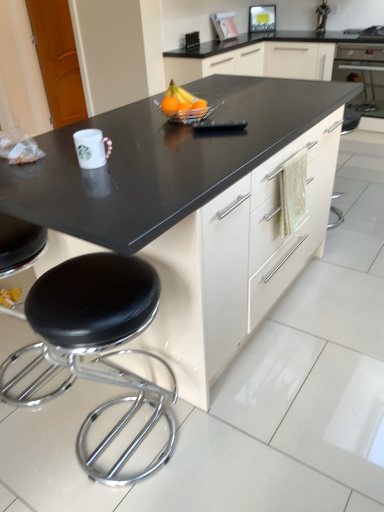
Question: Considering the relative positions of orange matte at center, positioned as the 2th orange in right-to-left order, and black glossy oven at upper right in the image provided, is orange matte at center, positioned as the 2th orange in right-to-left order, to the left of black glossy oven at upper right from the viewer's perspective?

Choices:
 (A) yes
 (B) no

Answer: (A)

Question: Considering the relative sizes of orange matte at center, positioned as the 2th orange in right-to-left order, and black glossy oven at upper right in the image provided, is orange matte at center, positioned as the 2th orange in right-to-left order, taller than black glossy oven at upper right?

Choices:
 (A) yes
 (B) no

Answer: (B)

Question: Is the depth of orange matte at center, positioned as the first orange in left-to-right order, less than that of black glossy oven at upper right?

Choices:
 (A) yes
 (B) no

Answer: (A)

Question: Is orange matte at center, positioned as the 2th orange in right-to-left order, oriented towards black glossy oven at upper right?

Choices:
 (A) no
 (B) yes

Answer: (A)

Question: Is black glossy oven at upper right inside orange matte at center, positioned as the 2th orange in right-to-left order?

Choices:
 (A) no
 (B) yes

Answer: (A)

Question: Is orange matte at center, the first orange from the right, situated inside orange matte at center, positioned as the first orange in left-to-right order, or outside?

Choices:
 (A) inside
 (B) outside

Answer: (B)

Question: From a real-world perspective, relative to orange matte at center, positioned as the first orange in left-to-right order, is orange matte at center, which appears as the second orange when viewed from the left, vertically above or below?

Choices:
 (A) above
 (B) below

Answer: (B)

Question: Is orange matte at center, which appears as the second orange when viewed from the left, wider or thinner than orange matte at center, positioned as the 2th orange in right-to-left order?

Choices:
 (A) wide
 (B) thin

Answer: (B)

Question: Is orange matte at center, the first orange from the right, taller or shorter than orange matte at center, positioned as the 2th orange in right-to-left order?

Choices:
 (A) short
 (B) tall

Answer: (A)

Question: Is point (162, 110) positioned closer to the camera than point (163, 97)?

Choices:
 (A) closer
 (B) farther

Answer: (A)

Question: Looking at the image, does glossy plastic bowl at center seem bigger or smaller compared to orange matte at center, positioned as the 2th orange in right-to-left order?

Choices:
 (A) big
 (B) small

Answer: (A)

Question: Is glossy plastic bowl at center spatially inside orange matte at center, positioned as the first orange in left-to-right order, or outside of it?

Choices:
 (A) outside
 (B) inside

Answer: (A)

Question: Is glossy plastic bowl at center in front of or behind orange matte at center, positioned as the 2th orange in right-to-left order, in the image?

Choices:
 (A) front
 (B) behind

Answer: (B)

Question: Considering their positions, is black leather stool at lower left located in front of or behind orange matte at center, the first orange from the right?

Choices:
 (A) behind
 (B) front

Answer: (B)

Question: Is black leather stool at lower left spatially inside orange matte at center, which appears as the second orange when viewed from the left, or outside of it?

Choices:
 (A) outside
 (B) inside

Answer: (A)